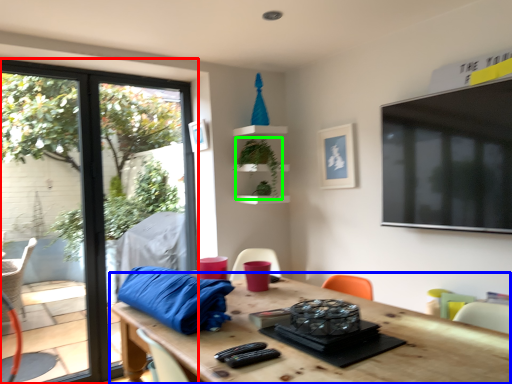
Question: Which is nearer to the window (highlighted by a red box)? table (highlighted by a blue box) or plant (highlighted by a green box).

Choices:
 (A) table
 (B) plant

Answer: (B)